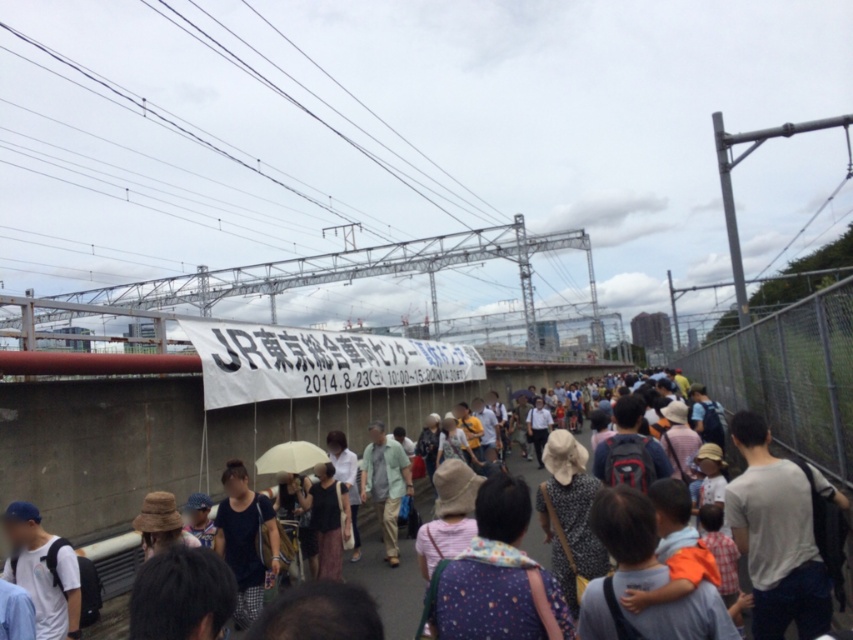
Question: Is white wire at upper center above beige matte umbrella at center?

Choices:
 (A) no
 (B) yes

Answer: (B)

Question: Where is white wire at upper center located in relation to white cotton shirt at center in the image?

Choices:
 (A) right
 (B) left

Answer: (B)

Question: Is white wire at upper center closer to the viewer compared to white cotton shirt at center?

Choices:
 (A) yes
 (B) no

Answer: (B)

Question: Which point is farther from the camera taking this photo?

Choices:
 (A) (421, 209)
 (B) (270, 468)
 (C) (381, 529)
 (D) (1, 481)

Answer: (A)

Question: Which point is closer to the camera taking this photo?

Choices:
 (A) (442, 193)
 (B) (428, 509)

Answer: (B)

Question: Which of the following is the farthest from the observer?

Choices:
 (A) light green fabric shirt at center
 (B) white wire at upper center
 (C) beige matte umbrella at center

Answer: (A)